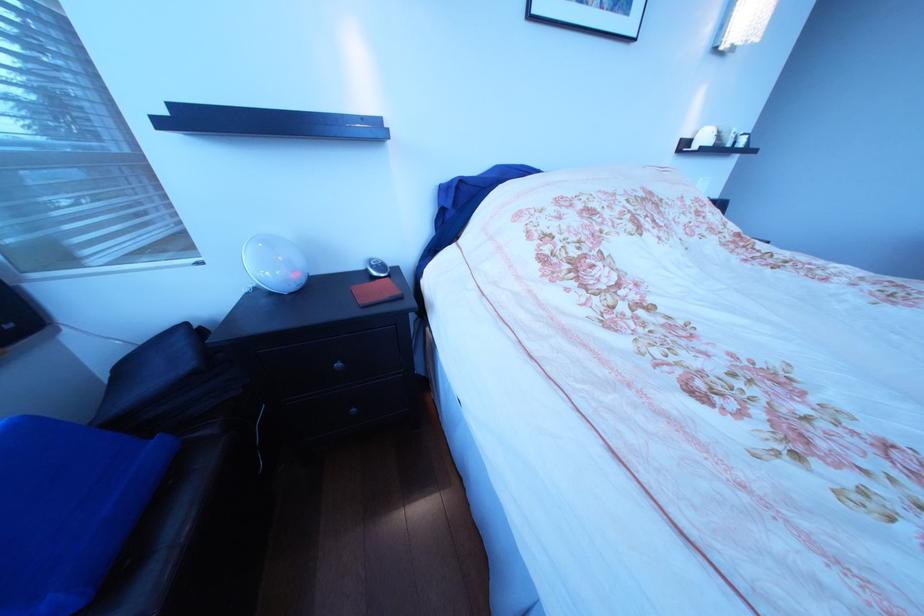
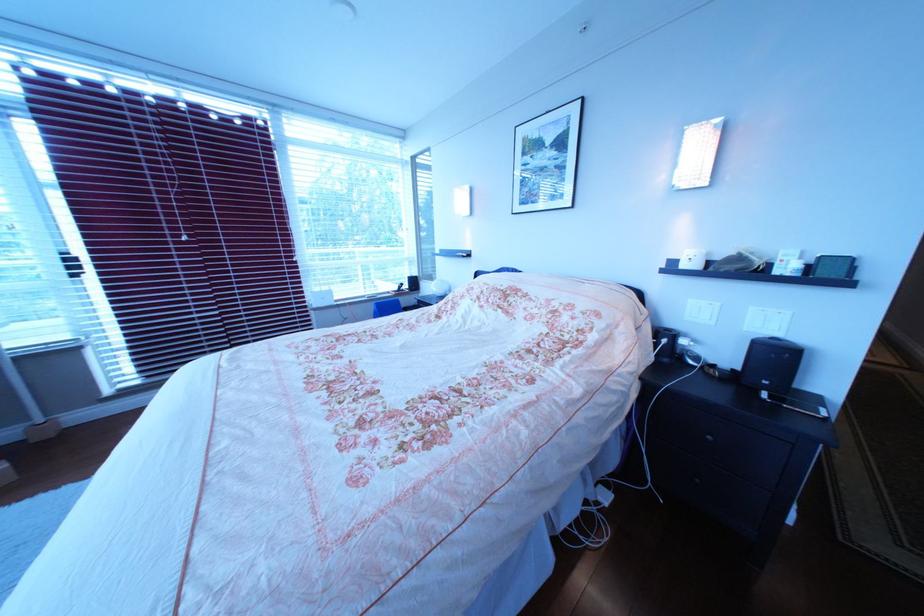
Question: I am providing you with two images of the same scene from different viewpoints. Which of the following objects are not visible in image2?

Choices:
 (A) glass and metal lantern
 (B) black speaker
 (C) light switch
 (D) red leather case

Answer: (D)